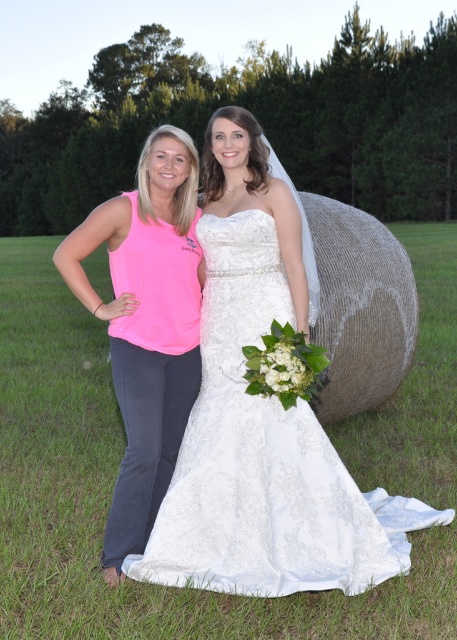
Does point (276, 525) lie behind point (75, 260)?

No.

Does white lace dress at center have a lesser width compared to pink fabric tank top at left?

No, white lace dress at center is not thinner than pink fabric tank top at left.

This screenshot has height=640, width=457. I want to click on white lace dress at center, so click(x=264, y=458).